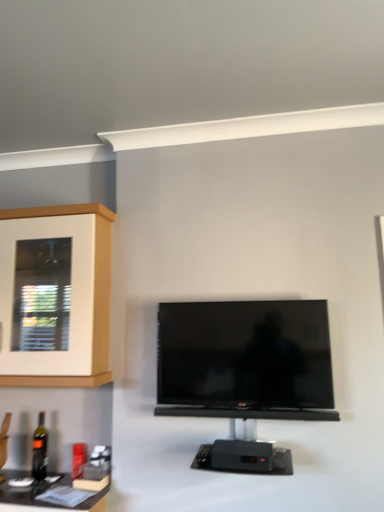
Question: Would you say wooden cabinet at left is to the left or to the right of black glossy tv at center in the picture?

Choices:
 (A) right
 (B) left

Answer: (B)

Question: From the image's perspective, is wooden cabinet at left located above or below black glossy tv at center?

Choices:
 (A) below
 (B) above

Answer: (B)

Question: Estimate the real-world distances between objects in this image. Which object is farther from the black glossy tv at center?

Choices:
 (A) wooden cabinet at left
 (B) black glass bottle at lower left

Answer: (B)

Question: Which object is positioned closest to the wooden cabinet at left?

Choices:
 (A) black glass bottle at lower left
 (B) black glossy tv at center

Answer: (B)